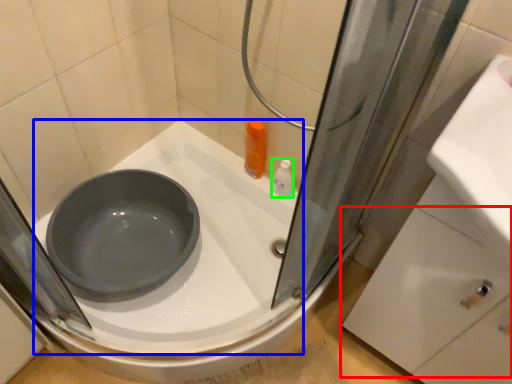
Question: Which is nearer to the drawer (highlighted by a red box)? bath (highlighted by a blue box) or toiletry (highlighted by a green box).

Choices:
 (A) bath
 (B) toiletry

Answer: (A)